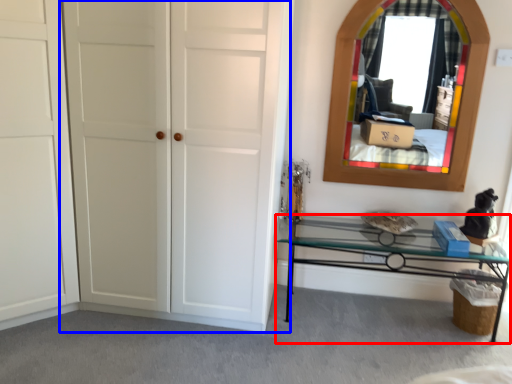
Question: Which object appears closest to the camera in this image, table (highlighted by a red box) or door (highlighted by a blue box)?

Choices:
 (A) table
 (B) door

Answer: (B)